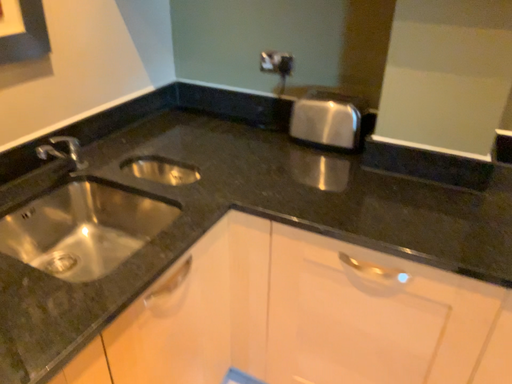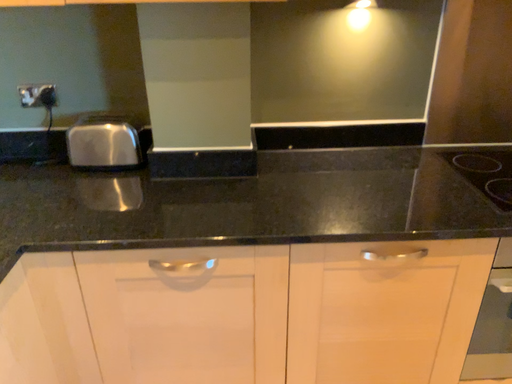
Question: How did the camera likely rotate when shooting the video?

Choices:
 (A) rotated downward
 (B) rotated upward

Answer: (B)